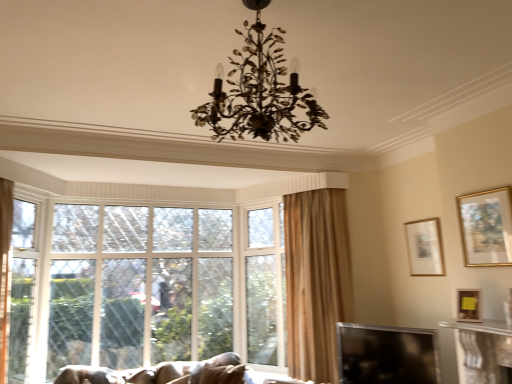
Question: Is gold-framed painting at upper right, which ranks as the first picture frame in front-to-back order, aimed at gold metallic chandelier at center?

Choices:
 (A) yes
 (B) no

Answer: (A)

Question: From the image's perspective, is gold-framed painting at upper right, which ranks as the first picture frame in front-to-back order, below gold metallic chandelier at center?

Choices:
 (A) yes
 (B) no

Answer: (A)

Question: Does gold-framed painting at upper right, which ranks as the first picture frame in front-to-back order, have a greater height compared to gold metallic chandelier at center?

Choices:
 (A) no
 (B) yes

Answer: (A)

Question: Considering the relative positions of gold-framed painting at upper right, which ranks as the first picture frame in front-to-back order, and gold metallic chandelier at center in the image provided, is gold-framed painting at upper right, which ranks as the first picture frame in front-to-back order, to the left of gold metallic chandelier at center from the viewer's perspective?

Choices:
 (A) no
 (B) yes

Answer: (A)

Question: Is gold-framed painting at upper right, the third picture frame from the back, smaller than gold metallic chandelier at center?

Choices:
 (A) yes
 (B) no

Answer: (A)

Question: From a real-world perspective, does gold-framed painting at upper right, which ranks as the first picture frame in front-to-back order, stand above gold metallic chandelier at center?

Choices:
 (A) yes
 (B) no

Answer: (B)

Question: Considering the relative sizes of transparent glass window screen at lower right and matte gold picture frame at upper right, placed as the first picture frame when sorted from back to front, in the image provided, is transparent glass window screen at lower right thinner than matte gold picture frame at upper right, placed as the first picture frame when sorted from back to front,?

Choices:
 (A) yes
 (B) no

Answer: (B)

Question: From the image's perspective, does transparent glass window screen at lower right appear lower than matte gold picture frame at upper right, which appears as the third picture frame when viewed from the front?

Choices:
 (A) no
 (B) yes

Answer: (B)

Question: Are transparent glass window screen at lower right and matte gold picture frame at upper right, which appears as the third picture frame when viewed from the front, far apart?

Choices:
 (A) no
 (B) yes

Answer: (A)

Question: Is transparent glass window screen at lower right smaller than matte gold picture frame at upper right, which appears as the third picture frame when viewed from the front?

Choices:
 (A) no
 (B) yes

Answer: (A)

Question: Does transparent glass window screen at lower right have a lesser height compared to matte gold picture frame at upper right, placed as the first picture frame when sorted from back to front?

Choices:
 (A) no
 (B) yes

Answer: (A)

Question: Would you say transparent glass window screen at lower right is outside matte gold picture frame at upper right, placed as the first picture frame when sorted from back to front?

Choices:
 (A) yes
 (B) no

Answer: (A)

Question: Considering the relative positions of clear glass screen door at left and velvet brown sofa at lower left in the image provided, is clear glass screen door at left behind velvet brown sofa at lower left?

Choices:
 (A) yes
 (B) no

Answer: (A)